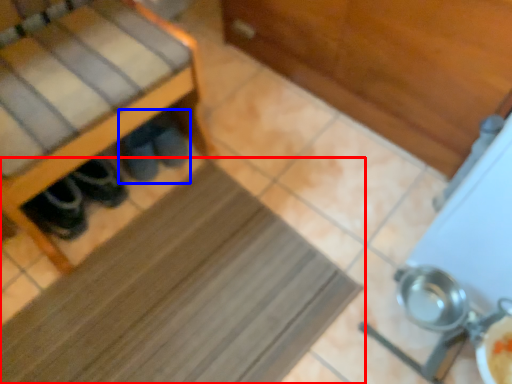
Question: Which point is further to the camera, mat (highlighted by a red box) or footwear (highlighted by a blue box)?

Choices:
 (A) mat
 (B) footwear

Answer: (B)